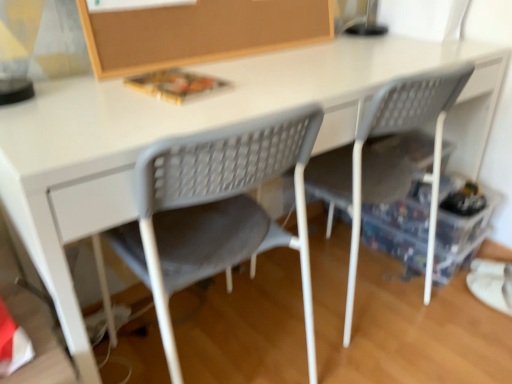
Where is `free area in between gray mesh chair at center, the second chair when ordered from right to left, and gray plastic chair at center, which appears as the 1th chair when viewed from the right`? free area in between gray mesh chair at center, the second chair when ordered from right to left, and gray plastic chair at center, which appears as the 1th chair when viewed from the right is located at coordinates (273, 321).